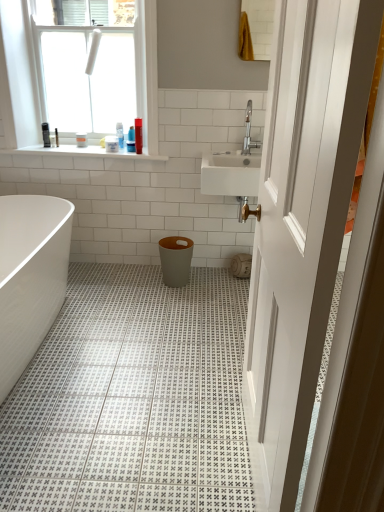
This screenshot has height=512, width=384. I want to click on matte gray trash can at center, so click(x=175, y=260).

In order to face white plastic container at upper center, should I rotate leftwards or rightwards?

Rotate your view left by about 11.242°.

This screenshot has width=384, height=512. What do you see at coordinates (30, 276) in the screenshot?
I see `white glossy bathtub at lower left` at bounding box center [30, 276].

This screenshot has width=384, height=512. I want to click on white glossy bathtub at lower left, so click(30, 276).

What do you see at coordinates (260, 26) in the screenshot? This screenshot has width=384, height=512. I see `gold textured towel at upper right` at bounding box center [260, 26].

Where is `matte gray trash can at center`? The width and height of the screenshot is (384, 512). matte gray trash can at center is located at coordinates (175, 260).

From the picture: Is matte gray trash can at center facing away from white plastic container at upper center?

No.

Is matte gray trash can at center spatially inside white plastic container at upper center, or outside of it?

matte gray trash can at center is not enclosed by white plastic container at upper center.

From a real-world perspective, which object rests below the other?

matte gray trash can at center.

Is matte gray trash can at center beside white plastic container at upper center?

No, matte gray trash can at center is not in contact with white plastic container at upper center.

Is white plastic container at upper center with silver metallic faucet at upper right?

There is a gap between white plastic container at upper center and silver metallic faucet at upper right.

Does point (117, 148) lie behind point (248, 146)?

That is True.

Is white plastic container at upper center smaller than silver metallic faucet at upper right?

Yes, white plastic container at upper center is smaller than silver metallic faucet at upper right.

Which is more to the right, white glossy bathtub at lower left or white plastic container at upper center?

A: From the viewer's perspective, white plastic container at upper center appears more on the right side.

Considering the points (30, 245) and (109, 143), which point is behind, point (30, 245) or point (109, 143)?

The point (109, 143) is farther from the camera.

From the image's perspective, is white glossy bathtub at lower left on top of white plastic container at upper center?

No, from the image's perspective, white glossy bathtub at lower left is not over white plastic container at upper center.

Is white glossy bathtub at lower left situated inside white plastic container at upper center or outside?

white glossy bathtub at lower left lies outside white plastic container at upper center.

Is point (243, 141) closer or farther from the camera than point (4, 264)?

Point (243, 141) is farther from the camera than point (4, 264).

In terms of height, does silver metallic faucet at upper right look taller or shorter compared to white glossy bathtub at lower left?

Considering their sizes, silver metallic faucet at upper right has less height than white glossy bathtub at lower left.

From a real-world perspective, who is located higher, silver metallic faucet at upper right or white glossy bathtub at lower left?

silver metallic faucet at upper right, from a real-world perspective.

At what (x,y) coordinates should I click in order to perform the action: click on bathtub that is on the left side of white glossy window at upper left. Please return your answer as a coordinate pair (x, y). The width and height of the screenshot is (384, 512). Looking at the image, I should click on (30, 276).

Would you say white glossy window at upper left is outside white glossy bathtub at lower left?

Yes, white glossy window at upper left is located beyond the bounds of white glossy bathtub at lower left.

Can you confirm if white glossy window at upper left is positioned to the left of white glossy bathtub at lower left?

In fact, white glossy window at upper left is to the right of white glossy bathtub at lower left.

Does white glossy window at upper left have a smaller size compared to white glossy counter top at upper left?

No, white glossy window at upper left is not smaller than white glossy counter top at upper left.

Measure the distance from white glossy window at upper left to white glossy counter top at upper left.

They are 17.32 inches apart.

Consider the image. Which is farther from the camera, (155, 148) or (139, 157)?

The point (139, 157) is farther.

Measure the distance from white glossy window at upper left to silver metallic faucet at upper right.

They are 3.64 feet apart.

Is white glossy window at upper left closer to the viewer compared to silver metallic faucet at upper right?

Yes, the depth of white glossy window at upper left is less than that of silver metallic faucet at upper right.

Is white glossy window at upper left not close to silver metallic faucet at upper right?

Yes, white glossy window at upper left and silver metallic faucet at upper right are quite far apart.

Would you say white glossy window at upper left is inside or outside silver metallic faucet at upper right?

The correct answer is: outside.

Find the location of a particular element. This screenshot has width=384, height=512. toilet bowl on the right of white plastic container at upper center is located at coordinates (175, 260).

At what (x,y) coordinates should I click in order to perform the action: click on tap that appears in front of the white plastic container at upper center. Please return your answer as a coordinate pair (x, y). Looking at the image, I should click on (249, 132).

When comparing their distances from gold textured towel at upper right, does matte gray trash can at center or silver metallic faucet at upper right seem closer?

silver metallic faucet at upper right is positioned closer to the anchor gold textured towel at upper right.

Based on their spatial positions, is white glossy counter top at upper left or white plastic container at upper center closer to matte gray trash can at center?

white glossy counter top at upper left.

Estimate the real-world distances between objects in this image. Which object is further from white plastic container at upper center, silver metallic faucet at upper right or gold textured towel at upper right?

gold textured towel at upper right lies further to white plastic container at upper center than the other object.

Looking at the image, which one is located further to white plastic container at upper center, white glossy window at upper left or gold textured towel at upper right?

Based on the image, gold textured towel at upper right appears to be further to white plastic container at upper center.

Based on their spatial positions, is white plastic container at upper center or white glossy window at upper left closer to gold textured towel at upper right?

white glossy window at upper left lies closer to gold textured towel at upper right than the other object.

From the image, which object appears to be farther from matte gray trash can at center, white glossy counter top at upper left or gold textured towel at upper right?

Based on the image, gold textured towel at upper right appears to be further to matte gray trash can at center.

Based on their spatial positions, is matte gray trash can at center or silver metallic faucet at upper right further from white glossy bathtub at lower left?

silver metallic faucet at upper right lies further to white glossy bathtub at lower left than the other object.

Which object lies further to the anchor point silver metallic faucet at upper right, white glossy bathtub at lower left or white plastic container at upper center?

Among the two, white glossy bathtub at lower left is located further to silver metallic faucet at upper right.

Where is `mirror located between white glossy bathtub at lower left and white plastic container at upper center in the depth direction`? mirror located between white glossy bathtub at lower left and white plastic container at upper center in the depth direction is located at coordinates (260, 26).

Find the location of a particular element. Image resolution: width=384 pixels, height=512 pixels. tap located between white glossy counter top at upper left and gold textured towel at upper right in the left-right direction is located at coordinates (249, 132).

The width and height of the screenshot is (384, 512). In order to click on tap between white glossy bathtub at lower left and white plastic container at upper center along the z-axis in this screenshot , I will do `click(249, 132)`.

Where is `counter top situated between white glossy bathtub at lower left and silver metallic faucet at upper right from left to right`? The width and height of the screenshot is (384, 512). counter top situated between white glossy bathtub at lower left and silver metallic faucet at upper right from left to right is located at coordinates tap(78, 153).